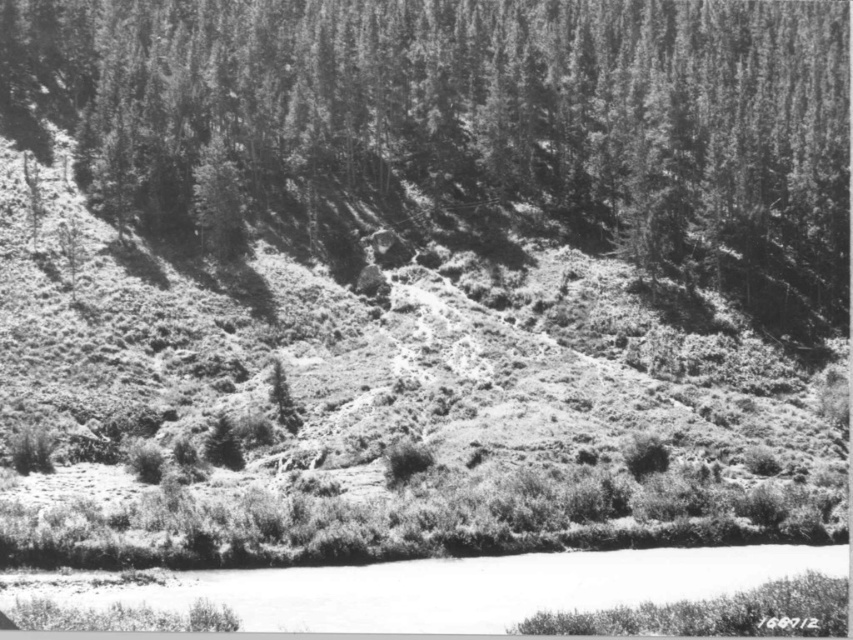
You are standing at the origin point in the image and want to reach the grassy hillside at center. Which direction should you move in to get there?

The grassy hillside at center is located at coordinates point (373, 404), so you should move towards the right and upward direction to reach it.

You are standing at the edge of the white smooth water at lower center and want to climb up to the grassy hillside at center. Is the path directly in front of you uphill or downhill?

The grassy hillside at center is positioned over the white smooth water at lower center, so the path directly in front of you is uphill.